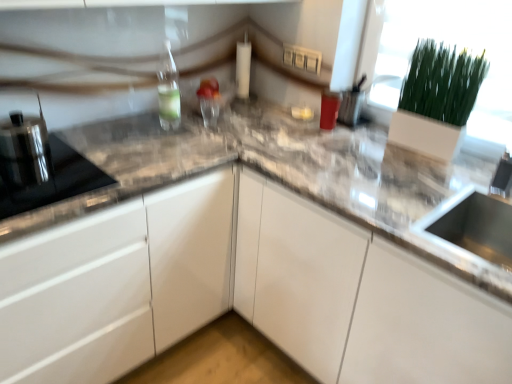
Question: Is satin black kettle at left, which is the 2th appliance from back to front, wider or thinner than matte plastic container at upper right, the 1th appliance when ordered from right to left?

Choices:
 (A) wide
 (B) thin

Answer: (A)

Question: Which is correct: satin black kettle at left, placed as the 2th appliance when sorted from front to back, is inside matte plastic container at upper right, the 1th appliance when ordered from right to left, or outside of it?

Choices:
 (A) inside
 (B) outside

Answer: (B)

Question: Which object is the farthest from the white glossy cabinet at center?

Choices:
 (A) matte plastic container at upper right, the 1th appliance when ordered from right to left
 (B) satin black kettle at left, marked as the first appliance in a left-to-right arrangement
 (C) clear glass bottle at upper left
 (D) white matte glass door at upper right
 (E) black glass cooktop at left, which is the 1th appliance in front-to-back order

Answer: (A)

Question: Based on their relative distances, which object is nearer to the satin black kettle at left, which is the 2th appliance from back to front?

Choices:
 (A) white glossy cabinet at center
 (B) clear glass bottle at upper left
 (C) matte plastic container at upper right, the first appliance in the back-to-front sequence
 (D) white matte glass door at upper right
 (E) black glass cooktop at left, which ranks as the 2th appliance in right-to-left order

Answer: (E)